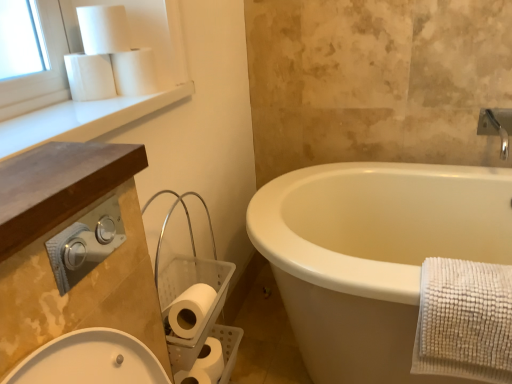
Question: From a real-world perspective, is white matte toilet paper at lower center, the first toilet paper ordered from the bottom, below white matte toilet paper at upper left, which is the 3th toilet paper in bottom-to-top order?

Choices:
 (A) yes
 (B) no

Answer: (A)

Question: Considering the relative sizes of white matte toilet paper at lower center, the first toilet paper ordered from the bottom, and white matte toilet paper at upper left, which is the 3th toilet paper in bottom-to-top order, in the image provided, is white matte toilet paper at lower center, the first toilet paper ordered from the bottom, smaller than white matte toilet paper at upper left, which is the 3th toilet paper in bottom-to-top order,?

Choices:
 (A) no
 (B) yes

Answer: (A)

Question: Does white matte toilet paper at lower center, acting as the fifth toilet paper starting from the top, turn towards white matte toilet paper at upper left, acting as the third toilet paper starting from the top?

Choices:
 (A) no
 (B) yes

Answer: (A)

Question: Is there a large distance between white matte toilet paper at lower center, the first toilet paper ordered from the bottom, and white matte toilet paper at upper left, acting as the third toilet paper starting from the top?

Choices:
 (A) no
 (B) yes

Answer: (A)

Question: Is white matte toilet paper at lower center, the first toilet paper ordered from the bottom, shorter than white matte toilet paper at upper left, which is the 3th toilet paper in bottom-to-top order?

Choices:
 (A) yes
 (B) no

Answer: (B)

Question: From a real-world perspective, is white matte toilet paper at lower center, acting as the fifth toilet paper starting from the top, above or below white matte toilet paper at upper left, acting as the 5th toilet paper starting from the bottom?

Choices:
 (A) above
 (B) below

Answer: (B)

Question: In the image, is white matte toilet paper at lower center, the first toilet paper ordered from the bottom, positioned in front of or behind white matte toilet paper at upper left, acting as the 5th toilet paper starting from the bottom?

Choices:
 (A) behind
 (B) front

Answer: (A)

Question: From the image's perspective, is white matte toilet paper at lower center, the first toilet paper ordered from the bottom, above or below white matte toilet paper at upper left, acting as the 5th toilet paper starting from the bottom?

Choices:
 (A) below
 (B) above

Answer: (A)

Question: Is point (208, 354) positioned closer to the camera than point (117, 38)?

Choices:
 (A) closer
 (B) farther

Answer: (B)

Question: Is white matte toilet paper at lower left, which is the 2th toilet paper in bottom-to-top order, bigger or smaller than white smooth window sill at upper left?

Choices:
 (A) big
 (B) small

Answer: (B)

Question: Relative to white smooth window sill at upper left, is white matte toilet paper at lower left, which is the 2th toilet paper in bottom-to-top order, in front or behind?

Choices:
 (A) front
 (B) behind

Answer: (B)

Question: From the image's perspective, relative to white smooth window sill at upper left, is white matte toilet paper at lower left, which is the 2th toilet paper in bottom-to-top order, above or below?

Choices:
 (A) below
 (B) above

Answer: (A)

Question: Do you think white matte toilet paper at lower left, the 4th toilet paper from the top, is within white smooth window sill at upper left, or outside of it?

Choices:
 (A) outside
 (B) inside

Answer: (A)

Question: Does point (19, 139) appear closer or farther from the camera than point (92, 8)?

Choices:
 (A) farther
 (B) closer

Answer: (B)

Question: In terms of height, does white smooth window sill at upper left look taller or shorter compared to white matte toilet paper at upper left, acting as the 5th toilet paper starting from the bottom?

Choices:
 (A) tall
 (B) short

Answer: (B)